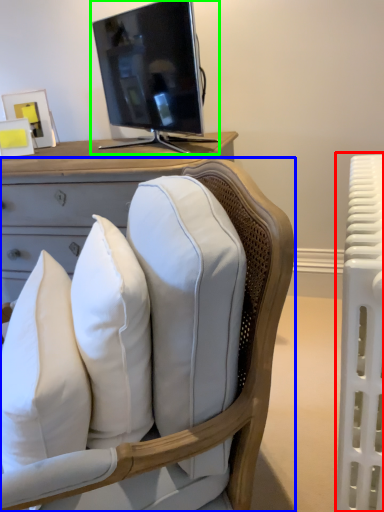
Question: Considering the real-world distances, which object is farthest from radiator (highlighted by a red box)? chair (highlighted by a blue box) or television (highlighted by a green box)?

Choices:
 (A) chair
 (B) television

Answer: (B)